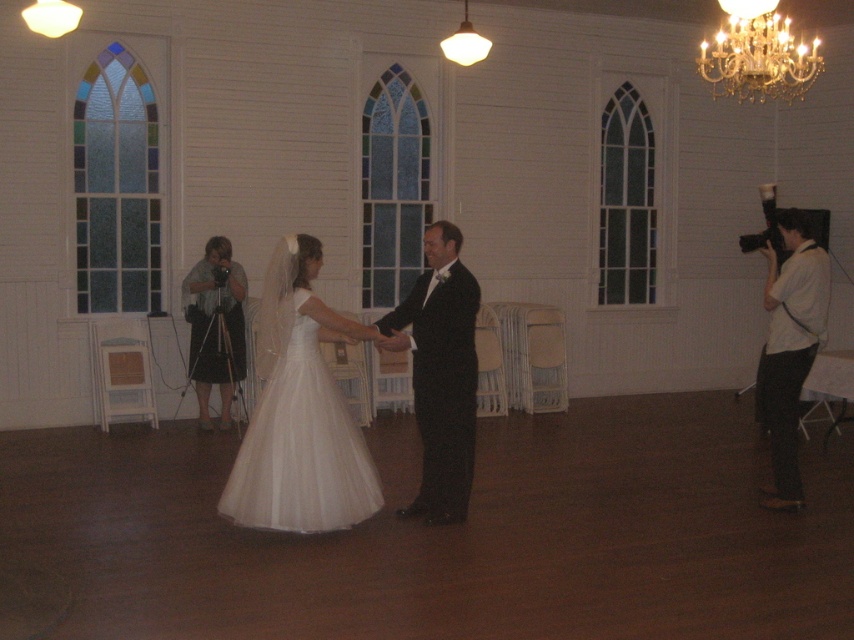
Question: Can you confirm if white satin dress at center is smaller than white shirt at right?

Choices:
 (A) no
 (B) yes

Answer: (B)

Question: Is white tulle dress at center below white shirt at right?

Choices:
 (A) no
 (B) yes

Answer: (B)

Question: Among these objects, which one is nearest to the camera?

Choices:
 (A) white shirt at right
 (B) white tulle dress at center
 (C) black satin tuxedo at center
 (D) white satin dress at center

Answer: (B)

Question: Can you confirm if white tulle dress at center is bigger than black satin tuxedo at center?

Choices:
 (A) yes
 (B) no

Answer: (A)

Question: Which point is closer to the camera?

Choices:
 (A) white tulle dress at center
 (B) white satin dress at center
 (C) black satin tuxedo at center

Answer: (A)

Question: Which of the following is the closest to the observer?

Choices:
 (A) white shirt at right
 (B) black satin tuxedo at center
 (C) gold crystal chandelier at upper right

Answer: (B)